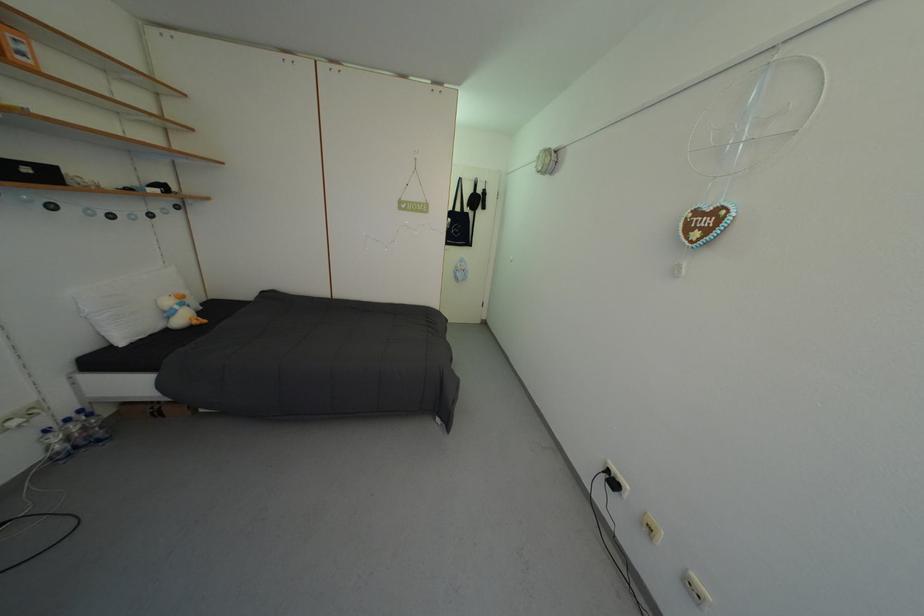
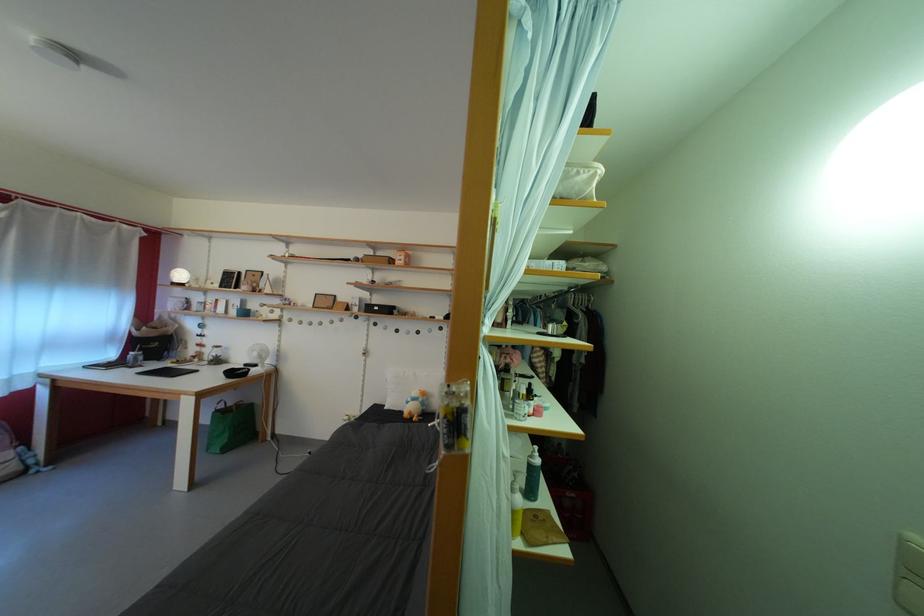
Locate, in the second image, the point that corresponds to (x=186, y=313) in the first image.

(418, 405)